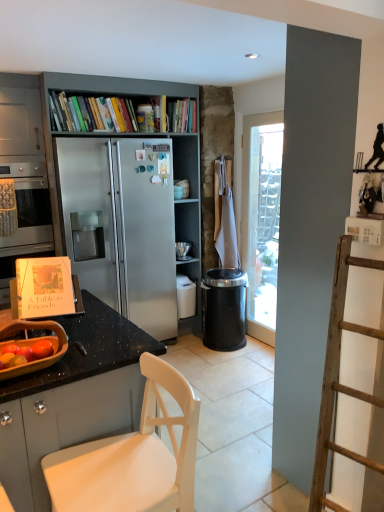
Question: Does metallic gray bookcase at center have a greater height compared to black plastic trash can at center-right?

Choices:
 (A) no
 (B) yes

Answer: (B)

Question: Considering the relative sizes of metallic gray bookcase at center and black plastic trash can at center-right in the image provided, is metallic gray bookcase at center thinner than black plastic trash can at center-right?

Choices:
 (A) no
 (B) yes

Answer: (A)

Question: Considering the relative sizes of metallic gray bookcase at center and black plastic trash can at center-right in the image provided, is metallic gray bookcase at center smaller than black plastic trash can at center-right?

Choices:
 (A) yes
 (B) no

Answer: (B)

Question: Would you say metallic gray bookcase at center is outside black plastic trash can at center-right?

Choices:
 (A) no
 (B) yes

Answer: (B)

Question: From a real-world perspective, does metallic gray bookcase at center stand above black plastic trash can at center-right?

Choices:
 (A) yes
 (B) no

Answer: (A)

Question: Based on their sizes in the image, would you say white matte chair at lower left is bigger or smaller than hardcover books at upper center, the first book viewed from the left?

Choices:
 (A) big
 (B) small

Answer: (A)

Question: Is white matte chair at lower left wider or thinner than hardcover books at upper center, the first book viewed from the left?

Choices:
 (A) thin
 (B) wide

Answer: (B)

Question: Would you say white matte chair at lower left is to the left or to the right of hardcover books at upper center, the 2th book in the right-to-left sequence, in the picture?

Choices:
 (A) left
 (B) right

Answer: (B)

Question: From the image's perspective, is white matte chair at lower left above or below hardcover books at upper center, the 2th book in the right-to-left sequence?

Choices:
 (A) below
 (B) above

Answer: (A)

Question: Looking at their shapes, would you say black plastic trash can at center-right is wider or thinner than stainless steel oven at left?

Choices:
 (A) wide
 (B) thin

Answer: (B)

Question: From a real-world perspective, is black plastic trash can at center-right above or below stainless steel oven at left?

Choices:
 (A) above
 (B) below

Answer: (B)

Question: In terms of size, does black plastic trash can at center-right appear bigger or smaller than stainless steel oven at left?

Choices:
 (A) small
 (B) big

Answer: (A)

Question: In the image, is black plastic trash can at center-right on the left side or the right side of stainless steel oven at left?

Choices:
 (A) right
 (B) left

Answer: (A)

Question: In terms of height, does black plastic trash can at center-right look taller or shorter compared to hardcover book at upper center, which is the first book from right to left?

Choices:
 (A) tall
 (B) short

Answer: (A)

Question: Visually, is black plastic trash can at center-right positioned to the left or to the right of hardcover book at upper center, which ranks as the 2th book in left-to-right order?

Choices:
 (A) left
 (B) right

Answer: (B)